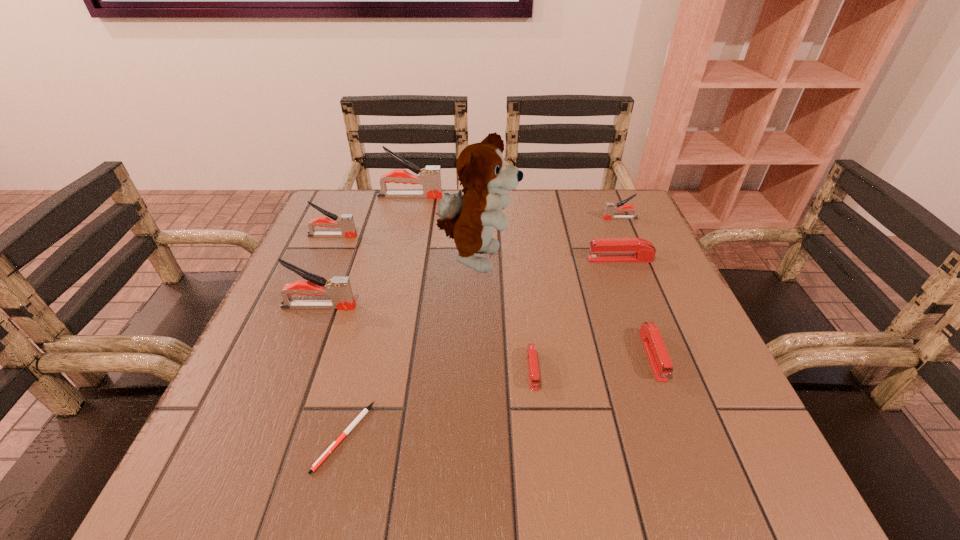
The width and height of the screenshot is (960, 540). Identify the location of brown puppy. (470, 218).

Where is `puppy`? The image size is (960, 540). puppy is located at coordinates (470, 218).

You are a GUI agent. You are given a task and a screenshot of the screen. Output one action in this format:
    pyautogui.click(x=<x>, y=<y>)
    Task: Click on the farthest object
    The height and width of the screenshot is (540, 960).
    Given the screenshot: What is the action you would take?
    pyautogui.click(x=430, y=177)

This screenshot has height=540, width=960. I want to click on the farthest gray stapler, so click(430, 177).

Identify the location of the third smallest gray stapler. (339, 289).

Where is `the sixth shortest stapler`? This screenshot has height=540, width=960. the sixth shortest stapler is located at coordinates (339, 289).

Where is `the fifth nearest stapler`? the fifth nearest stapler is located at coordinates (345, 222).

Locate an element on the screen. The width and height of the screenshot is (960, 540). the second smallest gray stapler is located at coordinates (345, 222).

Image resolution: width=960 pixels, height=540 pixels. I want to click on the second farthest stapler, so click(x=610, y=208).

Identify the location of the third nearest gray stapler. (610, 208).